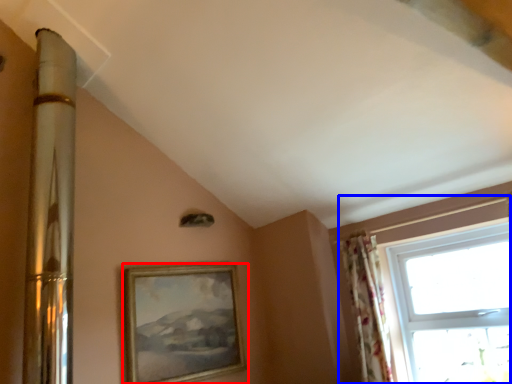
Question: Which object appears closest to the camera in this image, picture frame (highlighted by a red box) or window (highlighted by a blue box)?

Choices:
 (A) picture frame
 (B) window

Answer: (B)